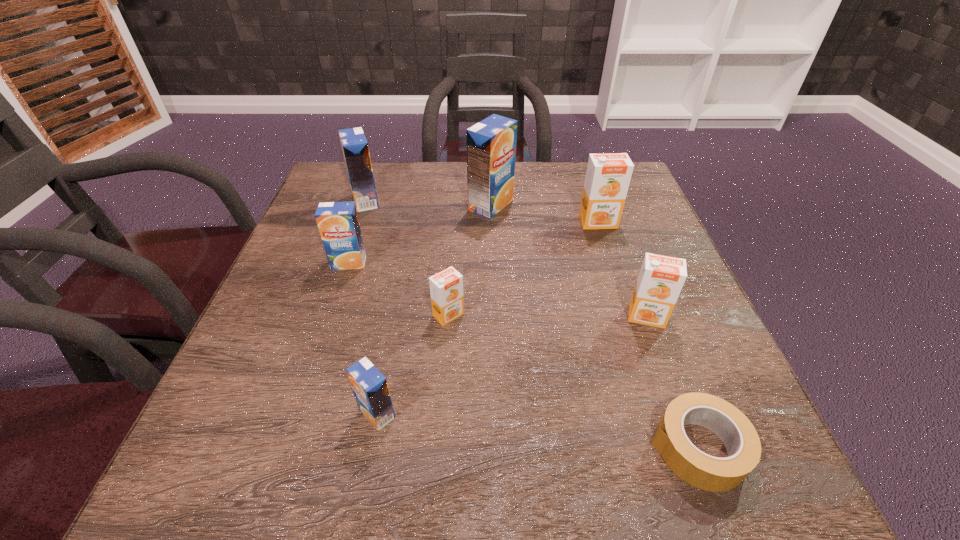
The width and height of the screenshot is (960, 540). Find the location of `vacant space at the far left corner of the desktop`. vacant space at the far left corner of the desktop is located at coordinates point(321,183).

Find the location of a particular element. The height and width of the screenshot is (540, 960). blank space at the far right corner is located at coordinates tap(644, 199).

This screenshot has width=960, height=540. In order to click on vacant space in between the shortest object and the rightmost blue orange_juice in this screenshot , I will do `click(594, 327)`.

The image size is (960, 540). I want to click on vacant region between the third smallest blue orange_juice and the duct tape, so (532, 325).

Identify the location of vacant region between the second smallest orange orange juice and the third blue orange_juice from left to right. This screenshot has width=960, height=540. (512, 365).

Where is `blank region between the biggest orange orange juice and the fifth object from left to right`? This screenshot has width=960, height=540. blank region between the biggest orange orange juice and the fifth object from left to right is located at coordinates (544, 214).

The height and width of the screenshot is (540, 960). I want to click on vacant area between the nearest orange juice and the duct tape, so click(x=538, y=430).

At what (x,y) coordinates should I click in order to perform the action: click on unoccupied position between the second biggest orange orange juice and the third smallest blue orange_juice. Please return your answer as a coordinate pair (x, y). Looking at the image, I should click on (506, 259).

The width and height of the screenshot is (960, 540). Identify the location of vacant area that lies between the second biggest orange orange juice and the duct tape. pyautogui.click(x=672, y=382).

This screenshot has width=960, height=540. Find the location of `free space that is in between the duct tape and the second biggest blue orange_juice`. free space that is in between the duct tape and the second biggest blue orange_juice is located at coordinates (532, 325).